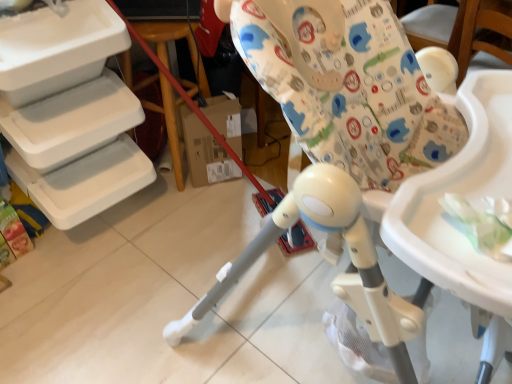
Identify the location of free region under white plastic highchair at center (from a real-world perspective). (309, 338).